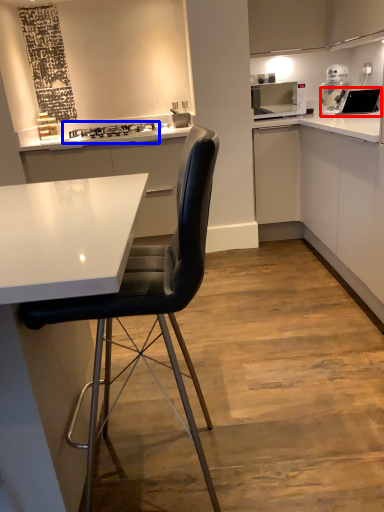
Question: Which object appears farthest to the camera in this image, sink (highlighted by a red box) or stove (highlighted by a blue box)?

Choices:
 (A) sink
 (B) stove

Answer: (B)